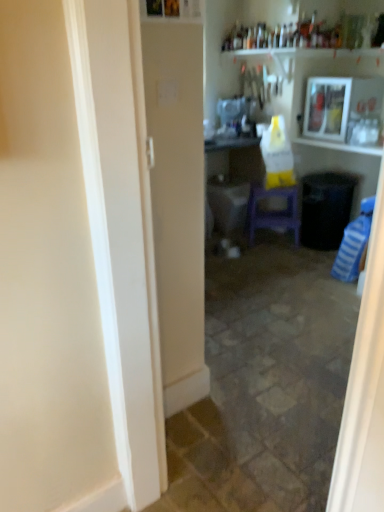
Question: Are purple plastic stool at center and wooden framed picture at upper right located far from each other?

Choices:
 (A) yes
 (B) no

Answer: (B)

Question: Does purple plastic stool at center have a lesser width compared to wooden framed picture at upper right?

Choices:
 (A) no
 (B) yes

Answer: (B)

Question: From the image's perspective, is purple plastic stool at center on wooden framed picture at upper right?

Choices:
 (A) yes
 (B) no

Answer: (B)

Question: Considering the relative sizes of purple plastic stool at center and wooden framed picture at upper right in the image provided, is purple plastic stool at center taller than wooden framed picture at upper right?

Choices:
 (A) yes
 (B) no

Answer: (A)

Question: Can you confirm if purple plastic stool at center is smaller than wooden framed picture at upper right?

Choices:
 (A) no
 (B) yes

Answer: (B)

Question: Can you confirm if purple plastic stool at center is positioned to the right of wooden framed picture at upper right?

Choices:
 (A) yes
 (B) no

Answer: (B)

Question: Does white glossy sink at center have a larger size compared to wooden framed picture at upper right?

Choices:
 (A) no
 (B) yes

Answer: (A)

Question: Would you say wooden framed picture at upper right is part of white glossy sink at center's contents?

Choices:
 (A) yes
 (B) no

Answer: (B)

Question: Is white glossy sink at center turned away from wooden framed picture at upper right?

Choices:
 (A) no
 (B) yes

Answer: (A)

Question: From the image's perspective, is white glossy sink at center below wooden framed picture at upper right?

Choices:
 (A) no
 (B) yes

Answer: (B)

Question: Does white glossy sink at center have a lesser height compared to wooden framed picture at upper right?

Choices:
 (A) yes
 (B) no

Answer: (A)

Question: From a real-world perspective, is white glossy sink at center over wooden framed picture at upper right?

Choices:
 (A) yes
 (B) no

Answer: (B)

Question: Is white glossy sink at center completely or partially inside wooden framed picture at upper right?

Choices:
 (A) no
 (B) yes

Answer: (A)